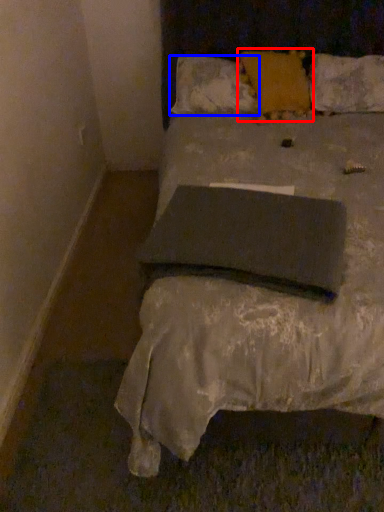
Question: Which of the following is the closest to the observer, pillow (highlighted by a red box) or pillow (highlighted by a blue box)?

Choices:
 (A) pillow
 (B) pillow

Answer: (A)